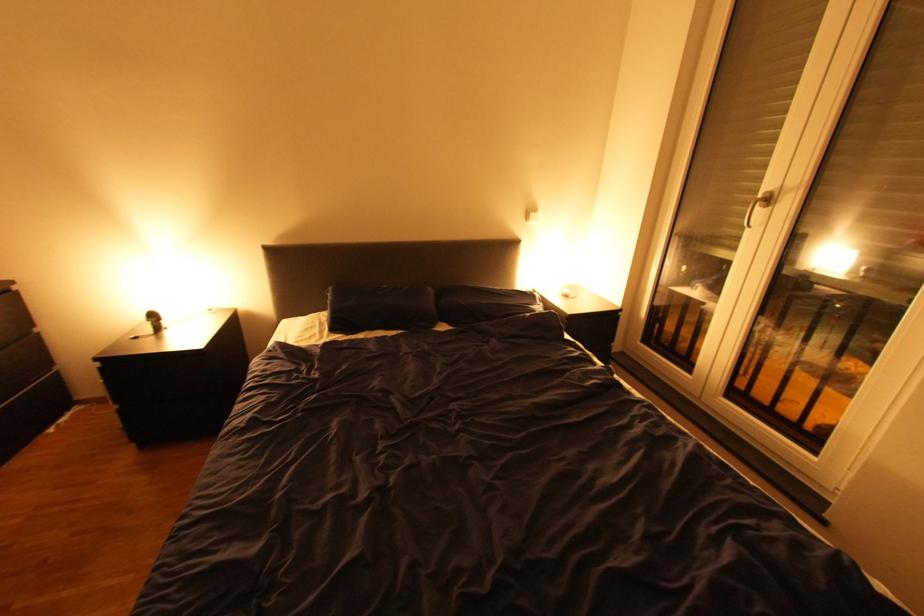
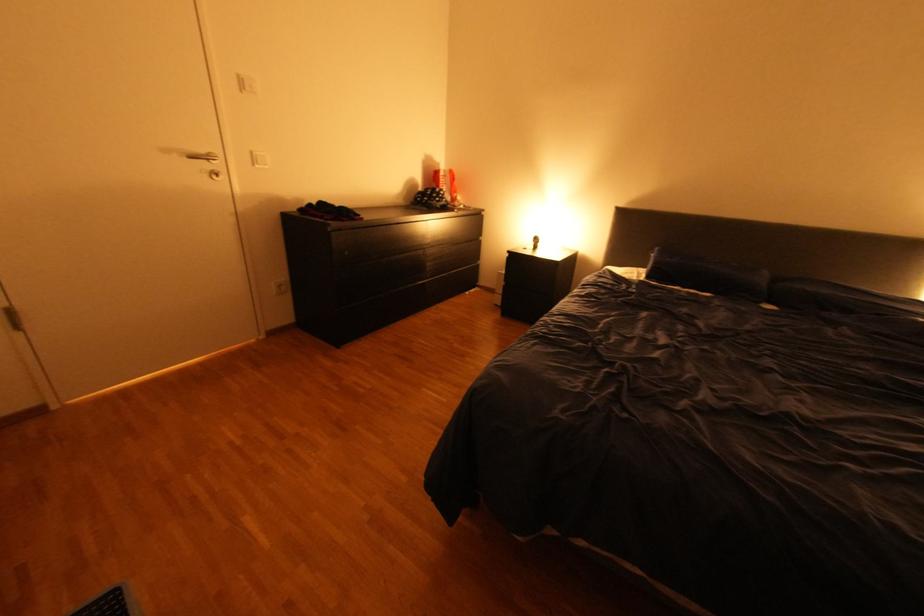
Locate, in the second image, the point that corresponds to point (331, 331) in the first image.

(648, 277)